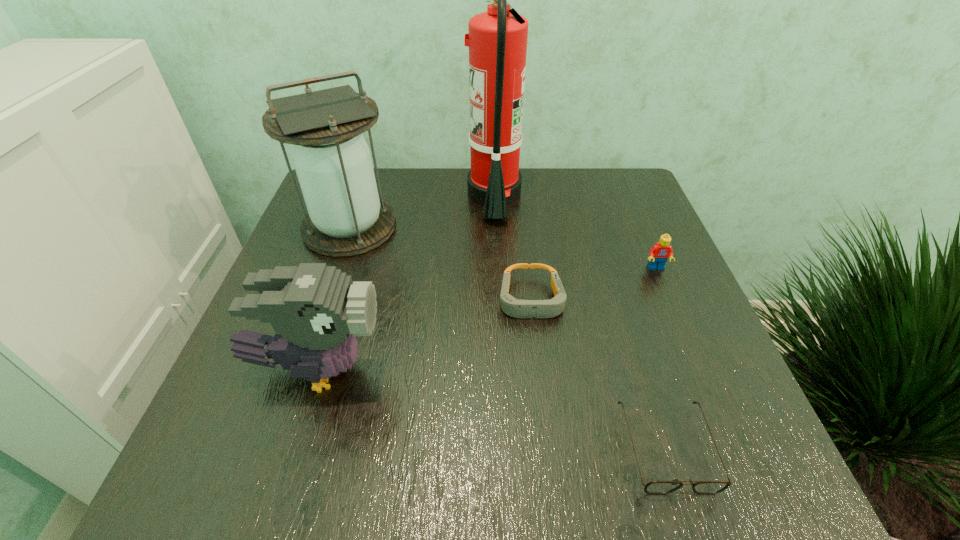
This screenshot has height=540, width=960. Identify the location of vacant region between the fourth farthest object and the fire extinguisher. (513, 247).

Locate which object is the fourth closest to the bird. Please provide its 2D coordinates. Your answer should be formatted as a tuple, i.e. [(x, y)], where the tuple contains the x and y coordinates of a point satisfying the conditions above.

[(497, 39)]

The height and width of the screenshot is (540, 960). In order to click on object that is the fourth closest to the second tallest object in this screenshot , I will do `click(659, 253)`.